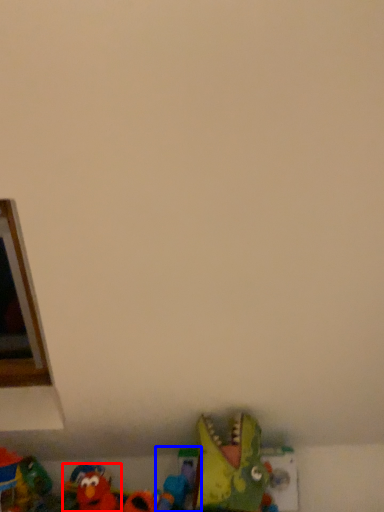
Question: Which object is closer to the camera taking this photo, toy (highlighted by a red box) or toy (highlighted by a blue box)?

Choices:
 (A) toy
 (B) toy

Answer: (A)